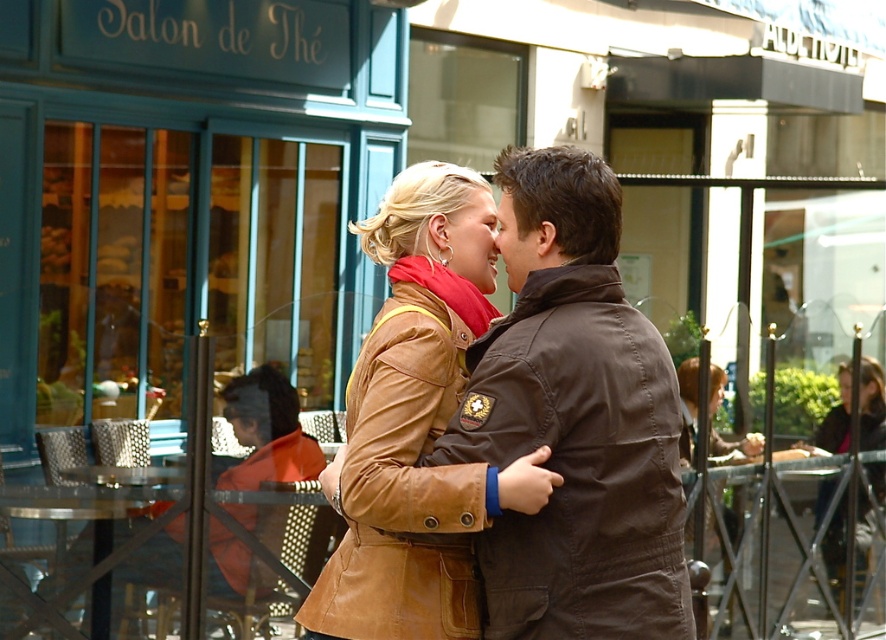
Looking at this image, between brown leather jacket at center and orange leather jacket at lower left, which one appears on the left side from the viewer's perspective?

orange leather jacket at lower left

Is brown leather jacket at center above orange leather jacket at lower left?

Correct, brown leather jacket at center is located above orange leather jacket at lower left.

Does point (618, 564) come behind point (293, 448)?

No, (618, 564) is in front of (293, 448).

Locate an element on the screen. The width and height of the screenshot is (886, 640). brown leather jacket at center is located at coordinates (573, 420).

Does brown leather jacket at center come in front of dark brown leather jacket at lower right?

Yes, brown leather jacket at center is closer to the viewer.

At what (x,y) coordinates should I click in order to perform the action: click on brown leather jacket at center. Please return your answer as a coordinate pair (x, y). This screenshot has height=640, width=886. Looking at the image, I should click on (573, 420).

Image resolution: width=886 pixels, height=640 pixels. What are the coordinates of `brown leather jacket at center` in the screenshot? It's located at (573, 420).

You are a GUI agent. You are given a task and a screenshot of the screen. Output one action in this format:
    pyautogui.click(x=<x>, y=<y>)
    Task: Click on the orange leather jacket at lower left
    
    Given the screenshot: What is the action you would take?
    pyautogui.click(x=267, y=432)

Which is more to the right, orange leather jacket at lower left or dark brown leather jacket at lower right?

Positioned to the right is dark brown leather jacket at lower right.

Who is more forward, [224,595] or [867,384]?

Point [224,595] is more forward.

Identify the location of orange leather jacket at lower left. This screenshot has height=640, width=886. (267, 432).